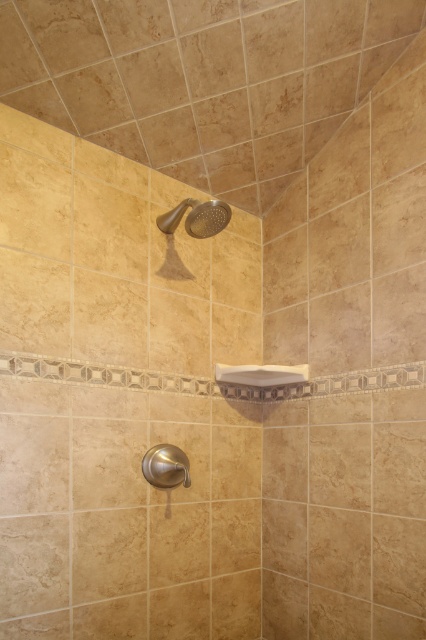
You are installing a new showerhead and handle in the shower area. The existing matte gold showerhead at upper center and the brushed metal shower handle at lower center are both in the way of the new installation. Which one is wider and needs to be removed first?

The matte gold showerhead at upper center might be wider than the brushed metal shower handle at lower center, so it should be removed first to accommodate the new installation.

You are installing a new showerhead and handle in the shower area. The current matte gold showerhead at upper center and the brushed metal shower handle at lower center have different sizes. Which one requires a larger mounting space?

The matte gold showerhead at upper center requires a larger mounting space because it is larger in size than the brushed metal shower handle at lower center.

You are a contractor installing a new shower system. The manufacturer recommends that the showerhead and handle should be at least 24 inches apart for optimal functionality. Based on the image, do the matte gold showerhead at upper center and the brushed metal shower handle at lower center meet this requirement?

The matte gold showerhead at upper center and the brushed metal shower handle at lower center are 25.14 inches apart from each other, which exceeds the recommended 24 inches, so they meet the requirement.